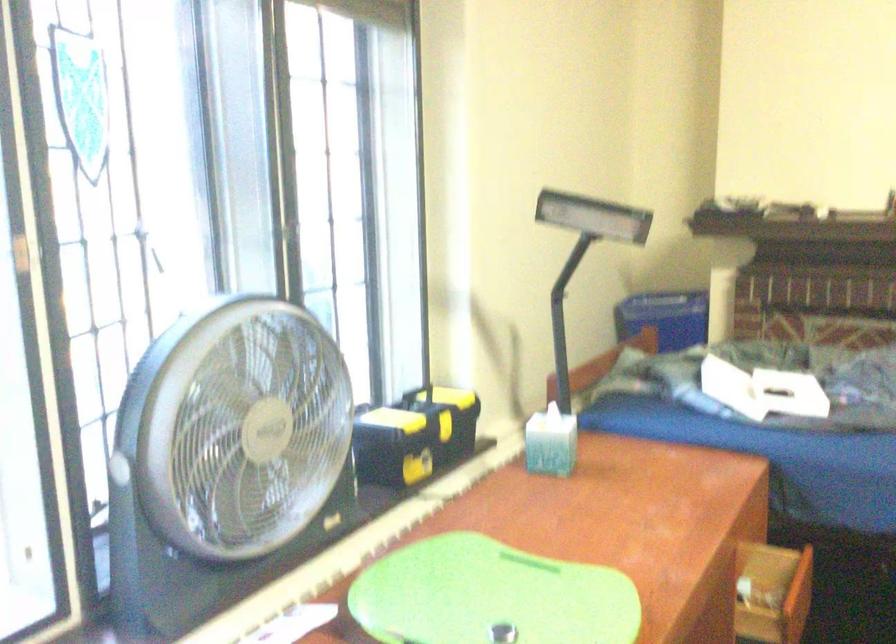
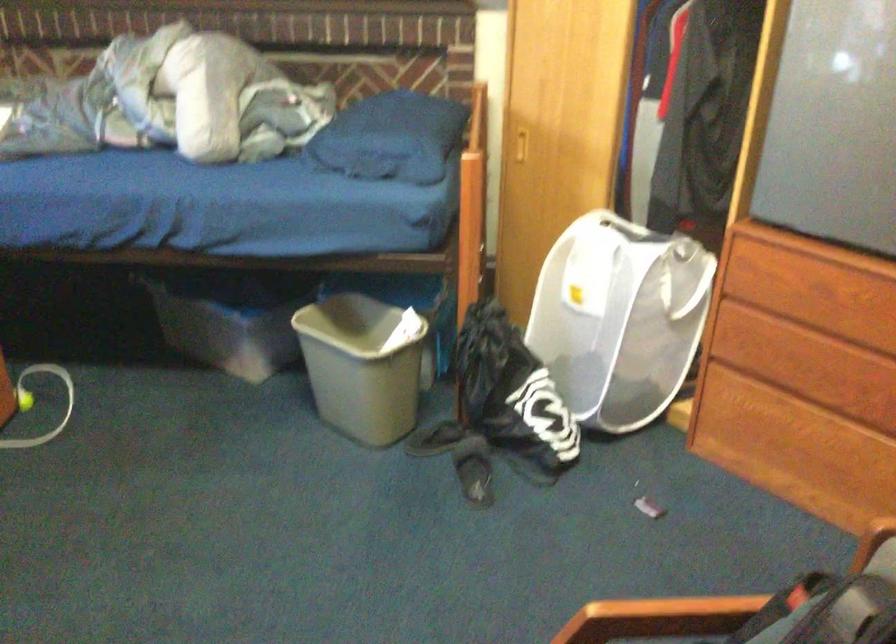
The first image is from the beginning of the video and the second image is from the end. How did the camera likely rotate when shooting the video?

The rotation direction of the camera is right-down.